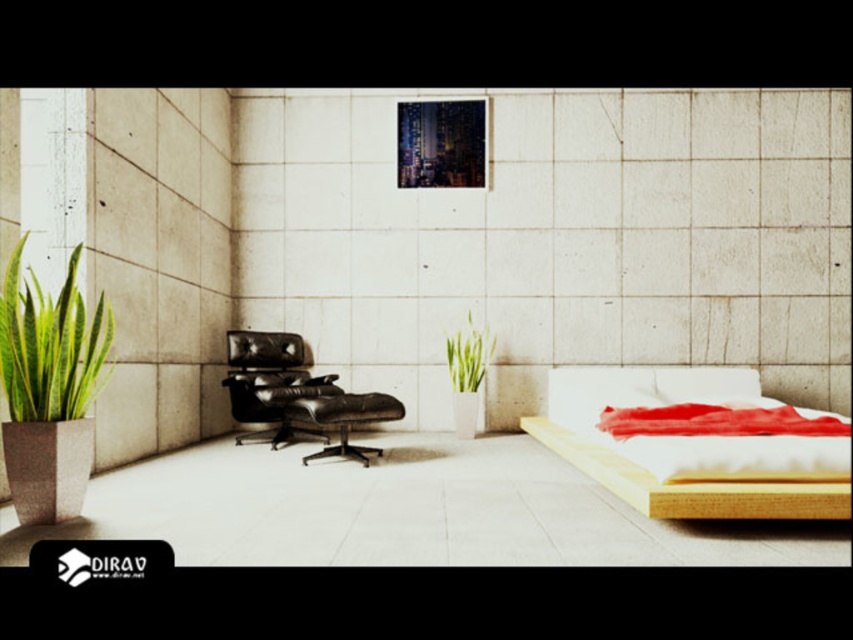
Question: Which object is farther from the camera taking this photo?

Choices:
 (A) green matte plant at center
 (B) white soft pillow at center

Answer: (A)

Question: Which object is positioned closest to the wooden bed at lower right?

Choices:
 (A) black leather swivel chair at center
 (B) green matte plant at center

Answer: (B)

Question: Is green leafy plant at left wider than green matte plant at center?

Choices:
 (A) yes
 (B) no

Answer: (B)

Question: Based on their relative distances, which object is farther from the green leafy plant at left?

Choices:
 (A) wooden bed at lower right
 (B) white soft pillow at center

Answer: (B)

Question: Where is green leafy plant at left located in relation to black leather swivel chair at center in the image?

Choices:
 (A) left
 (B) right

Answer: (A)

Question: Does white soft pillow at center have a smaller size compared to green matte plant at center?

Choices:
 (A) no
 (B) yes

Answer: (A)